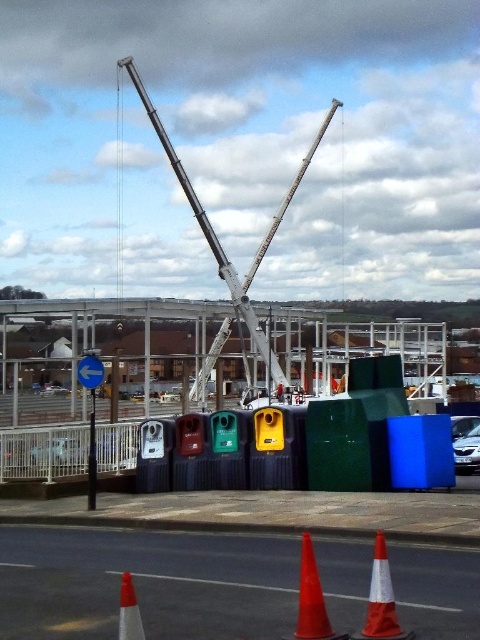
You are a delivery driver who needs to park your truck near the recycling bins. The truck requires a parking spot that is at least 2 meters wide. The point marked at coordinates (144, 584) indicates the location of the recycling bins. Can you determine if there is enough space to park your truck next to the recycling bins?

The point marked at coordinates (144, 584) indicates the location of the matte plastic recycling bins at center. However, the provided information does not specify the width of the area next to the recycling bins. Without knowing the width of the available space, it is impossible to confirm if it meets the 2 meters requirement. Please check the actual space dimensions before deciding to park.

You are a delivery driver approaching the construction site. You need to park your truck near the orange reflective cone at lower center without blocking the crane. Can you park your truck next to the white metallic crane at center?

The white metallic crane at center is larger than the orange reflective cone at lower center. Since the crane is bigger, parking next to it might not leave enough space for the truck. Find another spot closer to the cone instead.

What are the coordinates of the white metallic crane at center?

The white metallic crane at center is located at coordinates point (214, 230).